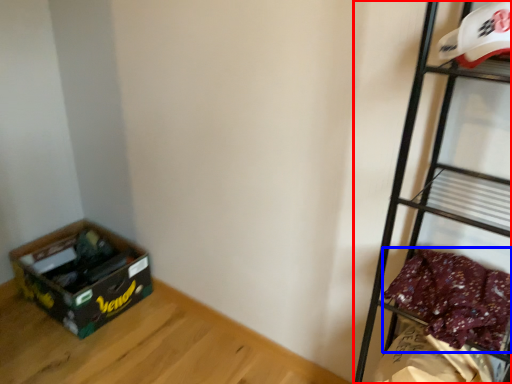
Question: Which object appears closest to the camera in this image, shelf (highlighted by a red box) or clothing (highlighted by a blue box)?

Choices:
 (A) shelf
 (B) clothing

Answer: (A)